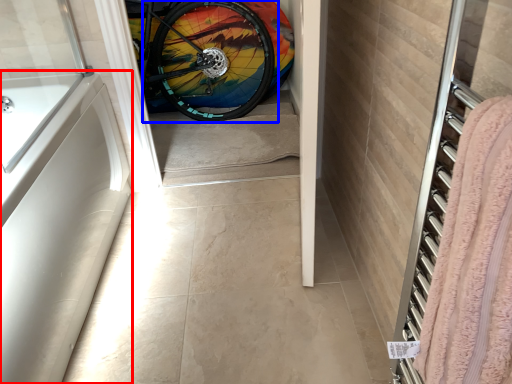
Question: Which point is closer to the camera, bath (highlighted by a red box) or bicycle wheel (highlighted by a blue box)?

Choices:
 (A) bath
 (B) bicycle wheel

Answer: (A)